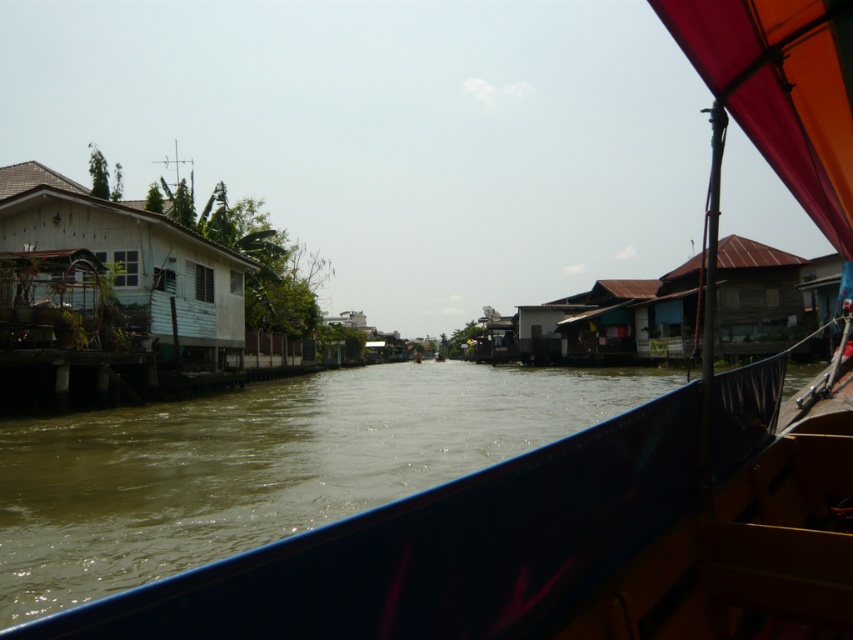
Question: Where is brown murky water at center located in relation to white weathered wood house at left in the image?

Choices:
 (A) left
 (B) right

Answer: (B)

Question: Estimate the real-world distances between objects in this image. Which object is farther from the white weathered wood house at left?

Choices:
 (A) brown wooden hut at right
 (B) brown murky water at center

Answer: (A)

Question: Considering the relative positions of brown murky water at center and brown wooden hut at right in the image provided, where is brown murky water at center located with respect to brown wooden hut at right?

Choices:
 (A) above
 (B) below

Answer: (B)

Question: Estimate the real-world distances between objects in this image. Which object is farther from the brown wooden hut at right?

Choices:
 (A) white weathered wood house at left
 (B) brown murky water at center

Answer: (A)

Question: Does brown murky water at center appear on the right side of brown wooden hut at right?

Choices:
 (A) yes
 (B) no

Answer: (B)

Question: Which of the following is the closest to the observer?

Choices:
 (A) (779, 291)
 (B) (241, 602)
 (C) (12, 177)

Answer: (B)